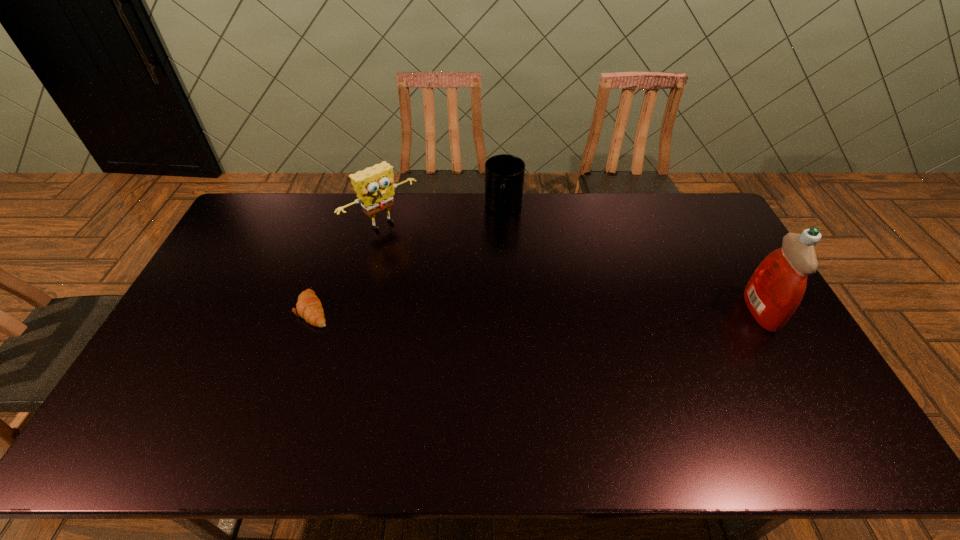
Locate an element on the screen. the shortest object is located at coordinates (309, 307).

Find the location of a particular element. This screenshot has height=540, width=960. the rightmost object is located at coordinates (776, 288).

This screenshot has height=540, width=960. I want to click on the tallest object, so click(776, 288).

Identify the location of mug. (504, 174).

This screenshot has width=960, height=540. Identify the location of the third object from left to right. (504, 174).

This screenshot has height=540, width=960. I want to click on sponge, so click(x=374, y=186).

You are a GUI agent. You are given a task and a screenshot of the screen. Output one action in this format:
    pyautogui.click(x=<x>, y=<y>)
    Task: Click on the free space located on the back of the crescent roll
    
    Given the screenshot: What is the action you would take?
    pyautogui.click(x=347, y=214)

Find the location of a particular element. Image resolution: width=960 pixels, height=540 pixels. free region located on the side of the mug with the handle is located at coordinates (501, 232).

Where is `vacant space located on the side of the mug with the handle`? The height and width of the screenshot is (540, 960). vacant space located on the side of the mug with the handle is located at coordinates (500, 240).

Locate an element on the screen. Image resolution: width=960 pixels, height=540 pixels. vacant point located 0.400m on the side of the mug with the handle is located at coordinates 493,307.